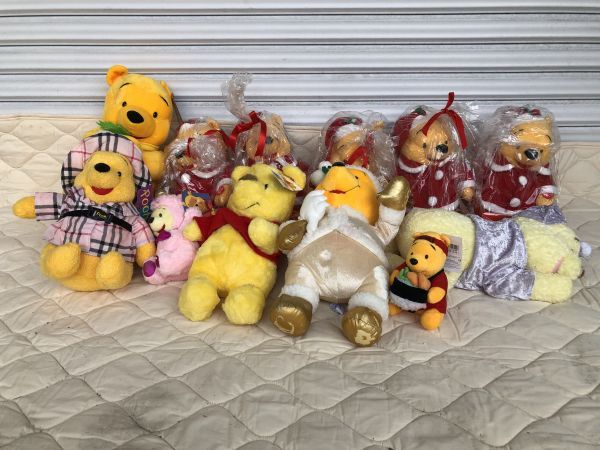
Where is `pooh bear plushie in plastic bag`? This screenshot has width=600, height=450. pooh bear plushie in plastic bag is located at coordinates (186, 153), (277, 135), (367, 147), (429, 160), (513, 171).